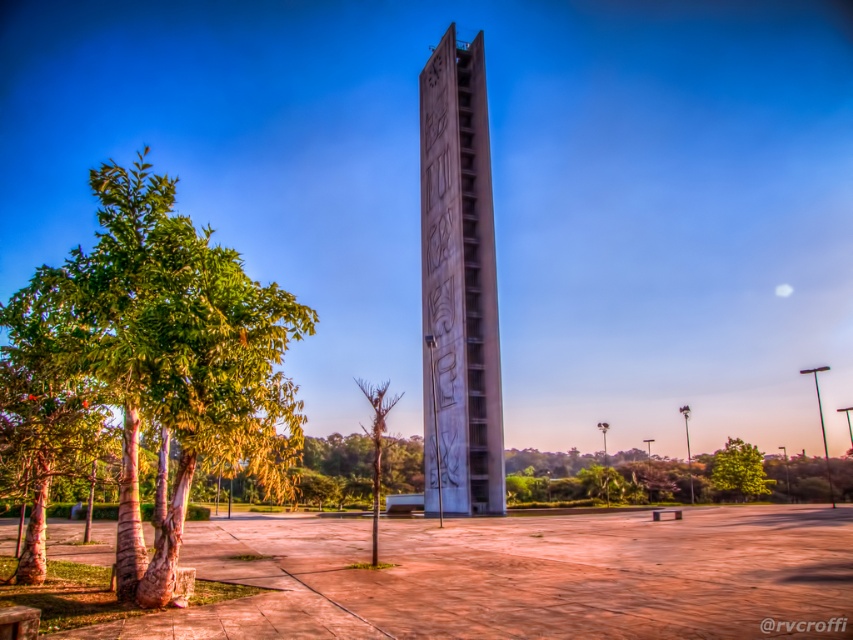
Question: Which point is farther to the camera?

Choices:
 (A) white concrete tower at center
 (B) green leafy tree at left
 (C) green leafy tree at center

Answer: (C)

Question: Can you confirm if green leafy tree at left is smaller than bare wood tree at center?

Choices:
 (A) no
 (B) yes

Answer: (A)

Question: Is white concrete tower at center to the right of bare wood tree at center from the viewer's perspective?

Choices:
 (A) no
 (B) yes

Answer: (B)

Question: Among these objects, which one is farthest from the camera?

Choices:
 (A) bare wood tree at center
 (B) green leafy tree at center
 (C) green leafy tree at left

Answer: (B)

Question: Among these objects, which one is farthest from the camera?

Choices:
 (A) green leafy tree at center
 (B) bare wood tree at center

Answer: (A)

Question: Does green leafy tree at center lie behind bare wood tree at center?

Choices:
 (A) no
 (B) yes

Answer: (B)